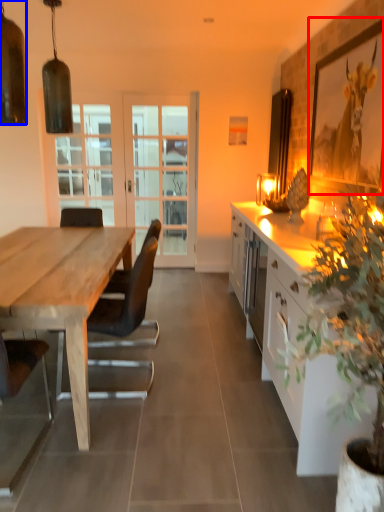
Question: Which of the following is the closest to the observer, picture frame (highlighted by a red box) or lamp (highlighted by a blue box)?

Choices:
 (A) picture frame
 (B) lamp

Answer: (B)